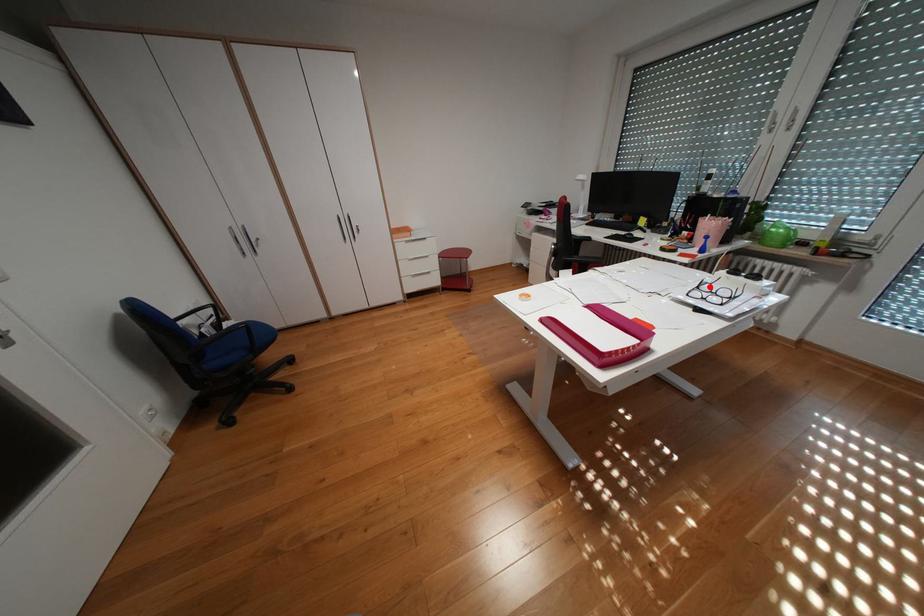
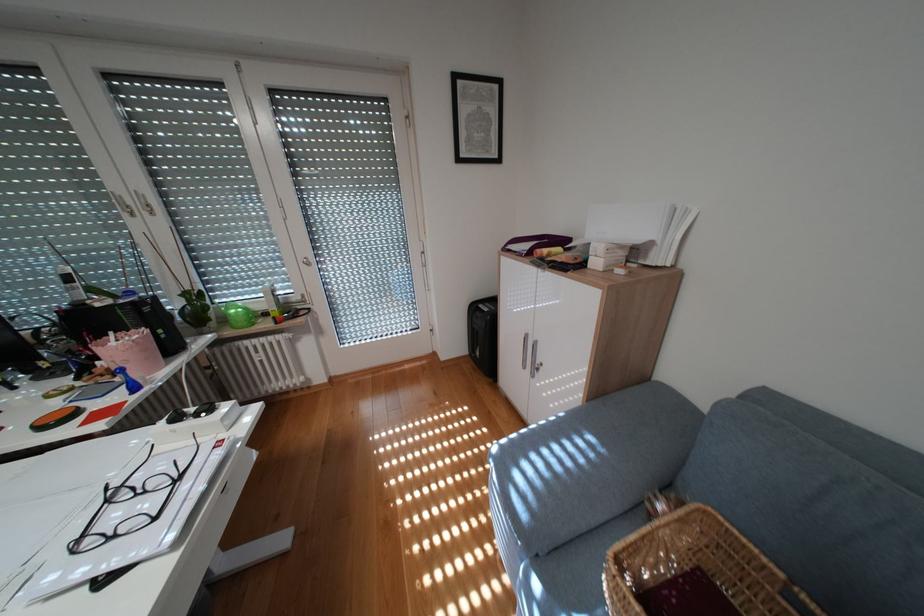
Where in the second image is the point corresponding to the highlighted location from the first image?

(119, 501)